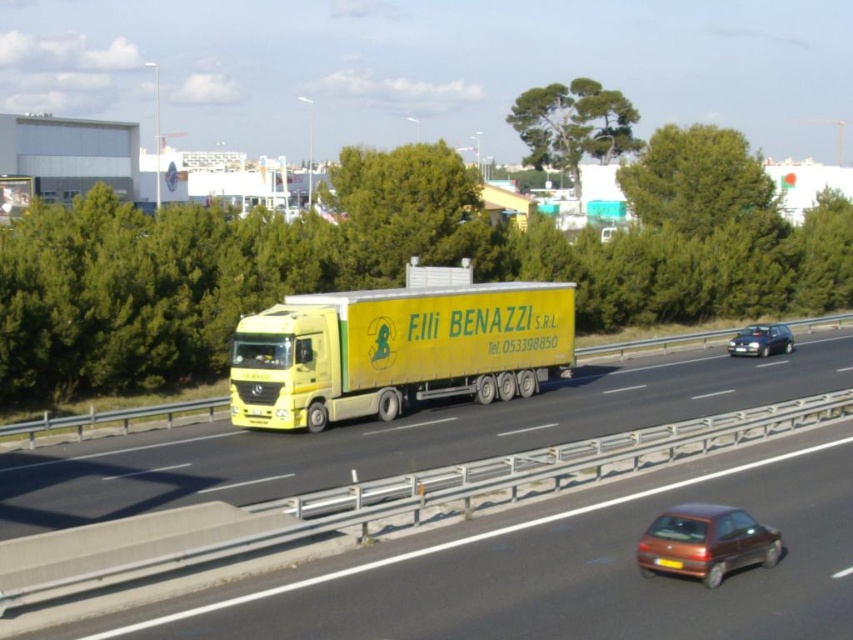
Looking at this image, you are standing on the side of the highway and see the yellow matte truck at center approaching you. If the truck is moving at 60 mph, how many seconds will it take for the truck to reach your position?

The yellow matte truck at center is 41.28 feet away from the viewer. At 60 mph, the truck travels 88 feet per second. Time is distance divided by speed, so 41.28 divided by 88 equals approximately 0.47 seconds. The truck will reach the viewer in about 0.47 seconds.

You are a driver in the red car and want to overtake the yellow matte truck at center and its attached yellow matte trailer truck at center. Given that your car can accelerate up to 70 mph, and the truck is moving at 50 mph, will you be able to safely pass them within the next 0.5 miles? Consider the distance between the truck and trailer and the road layout described in the scene.

The yellow matte truck at center is 13.57 feet from the yellow matte trailer truck at center. Since the distance between them is relatively short, there is limited space to maneuver safely. Additionally, the presence of a concrete barrier with metal railings in the foreground indicates that there might not be an adjacent lane for overtaking. Therefore, it is not advisable to attempt passing them within the next 0.5 miles due to insufficient space and potential safety risks.

You are a driver in the red car observing the yellow matte truck at center and the yellow matte trailer truck at center ahead. Which one is longer?

The yellow matte trailer truck at center is longer than the yellow matte truck at center.